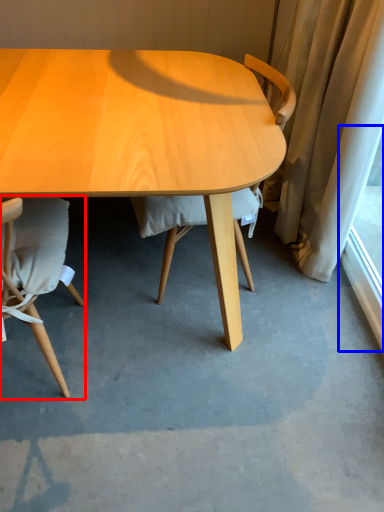
Question: Which object appears closest to the camera in this image, chair (highlighted by a red box) or window screen (highlighted by a blue box)?

Choices:
 (A) chair
 (B) window screen

Answer: (A)